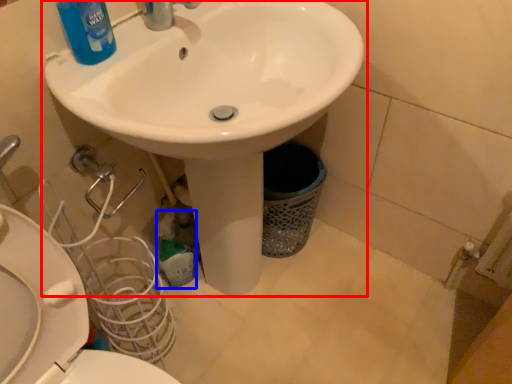
Question: Among these objects, which one is nearest to the camera, sink (highlighted by a red box) or cleaning product (highlighted by a blue box)?

Choices:
 (A) sink
 (B) cleaning product

Answer: (A)